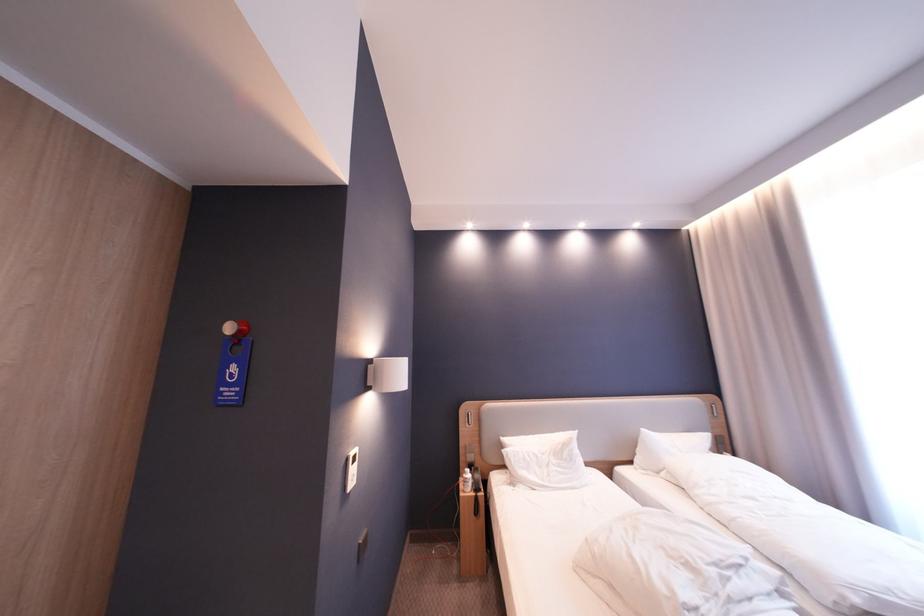
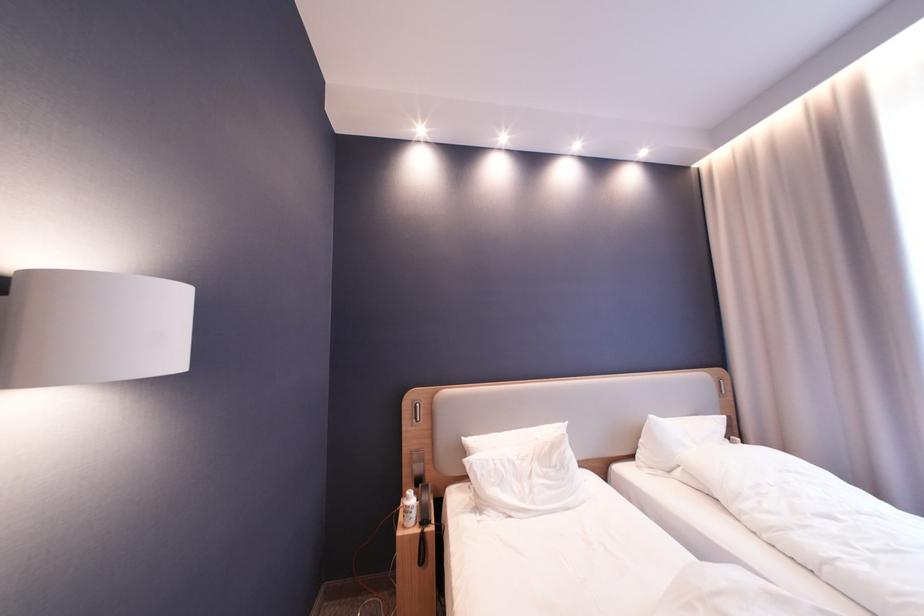
Question: Based on the continuous images, in which direction is the camera rotating? Reply with the corresponding letter.

Choices:
 (A) Left
 (B) Right
 (C) Up
 (D) Down

Answer: (B)